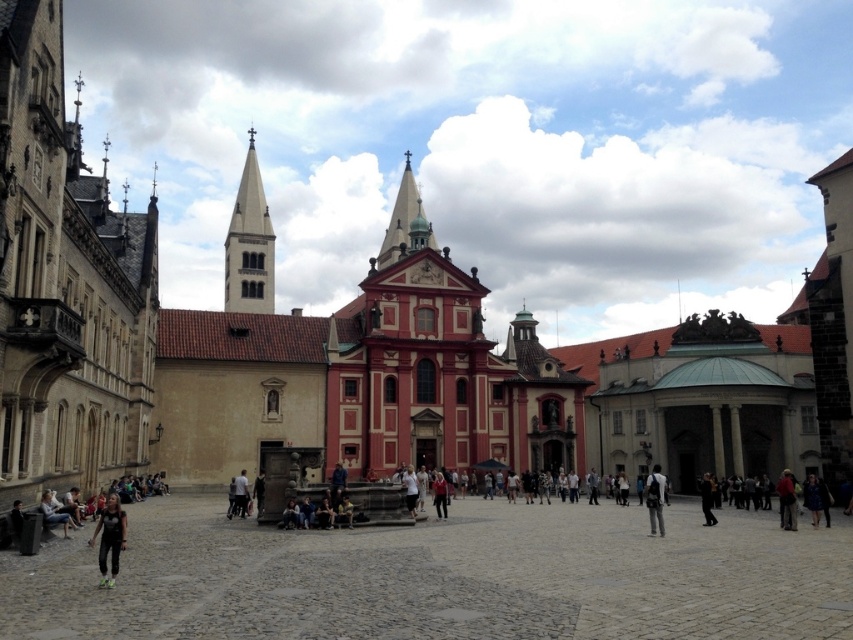
You are standing in the historic building complex square. You see the cobblestone plaza at center and the dark gray fabric pants at center. Which object is closer to the ground?

The cobblestone plaza at center is located below the dark gray fabric pants at center, so the cobblestone plaza at center is closer to the ground.

You are an architect visiting the square and want to take a photo of the matte pink building at center and the black leather jacket at center. Since you want both to be in the frame, which object should you focus on to ensure both are visible?

The matte pink building at center is wider than the black leather jacket at center, so focusing on the matte pink building at center will ensure both are visible in the frame.